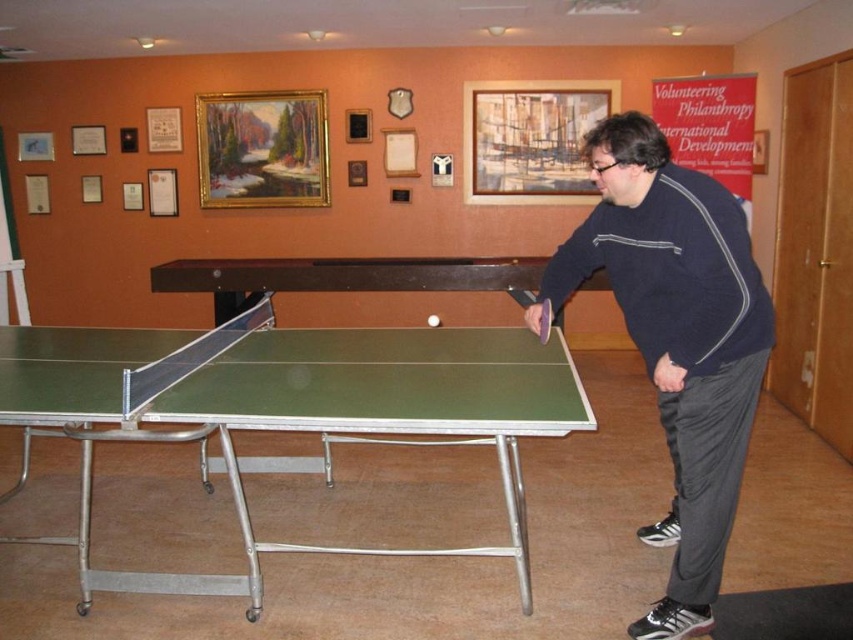
Which is in front, point (80, 428) or point (512, 292)?

Point (80, 428) is more forward.

Does green rubber table at center have a lesser height compared to green rubber table tennis table at center?

Incorrect, green rubber table at center's height does not fall short of green rubber table tennis table at center's.

Is point (364, 337) more distant than point (519, 291)?

No.

The image size is (853, 640). I want to click on green rubber table at center, so click(299, 412).

Is dark blue sweater at right bigger than green rubber table tennis table at center?

Yes.

Which is in front, point (604, 257) or point (544, 308)?

Point (604, 257)

You are a GUI agent. You are given a task and a screenshot of the screen. Output one action in this format:
    pyautogui.click(x=<x>, y=<y>)
    Task: Click on the dark blue sweater at right
    This screenshot has height=640, width=853.
    Given the screenshot: What is the action you would take?
    pyautogui.click(x=677, y=339)

Locate an element on the screen. dark blue sweater at right is located at coordinates (677, 339).

Is dark blue sweater at right taller than green plastic table tennis table at center?

Indeed, dark blue sweater at right has a greater height compared to green plastic table tennis table at center.

Identify the location of dark blue sweater at right. (677, 339).